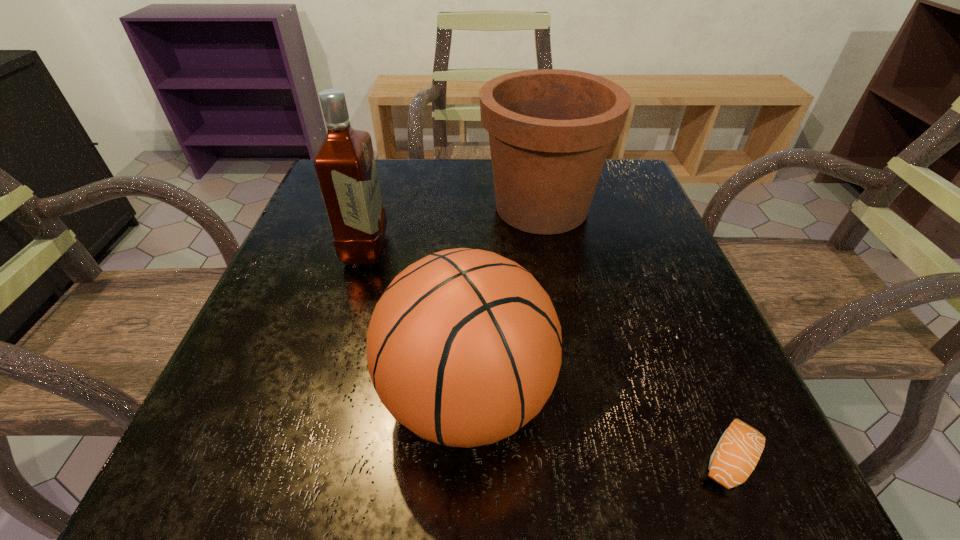
Image resolution: width=960 pixels, height=540 pixels. I want to click on object located in the far edge section of the desktop, so click(550, 130).

This screenshot has width=960, height=540. What are the coordinates of `basketball that is at the near edge` in the screenshot? It's located at (464, 347).

You are a GUI agent. You are given a task and a screenshot of the screen. Output one action in this format:
    pyautogui.click(x=<x>, y=<y>)
    Task: Click on the sushi that is positioned at the near edge
    The width and height of the screenshot is (960, 540).
    Given the screenshot: What is the action you would take?
    pyautogui.click(x=738, y=451)

The image size is (960, 540). I want to click on object that is at the left edge, so click(345, 166).

Find the location of a particular element. This screenshot has width=960, height=540. flowerpot present at the right edge is located at coordinates (550, 130).

Identify the location of sushi that is at the right edge. Image resolution: width=960 pixels, height=540 pixels. (738, 451).

You are a GUI agent. You are given a task and a screenshot of the screen. Output one action in this format:
    pyautogui.click(x=<x>, y=<y>)
    Task: Click on the object positioned at the far right corner
    The image size is (960, 540).
    Given the screenshot: What is the action you would take?
    pyautogui.click(x=550, y=130)

What are the coordinates of `object that is at the near right corner` in the screenshot? It's located at (738, 451).

At what (x,y) coordinates should I click in order to perform the action: click on free spot at the far edge of the desktop. Please return your answer as a coordinate pair (x, y). The image size is (960, 540). Looking at the image, I should click on (462, 196).

Locate an element on the screen. This screenshot has height=540, width=960. free region at the near edge of the desktop is located at coordinates (500, 476).